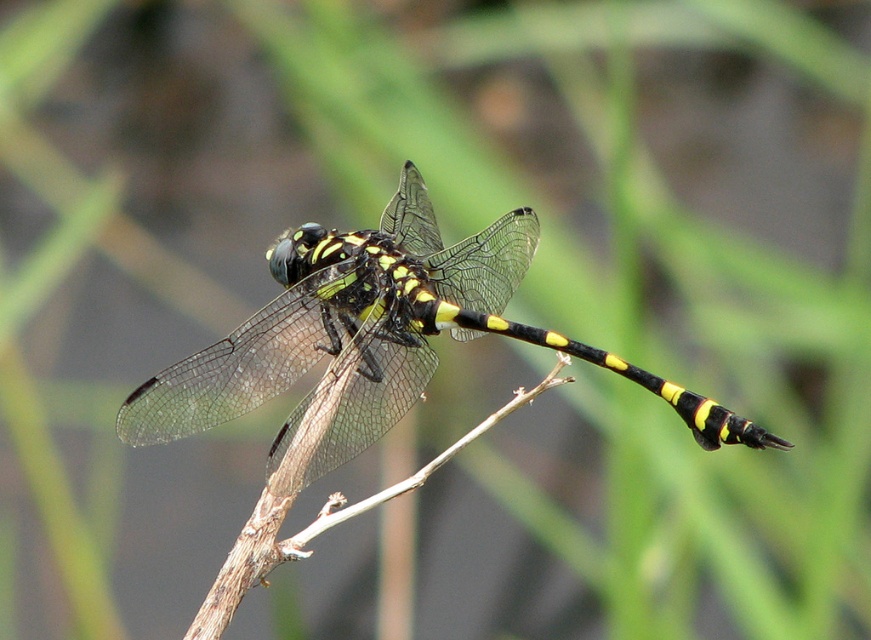
Between yellow-black dragonfly at center and black/yellow striped tail at center-right, which one is positioned lower?

Result: Positioned lower is black/yellow striped tail at center-right.

Locate an element on the screen. The height and width of the screenshot is (640, 871). yellow-black dragonfly at center is located at coordinates (375, 340).